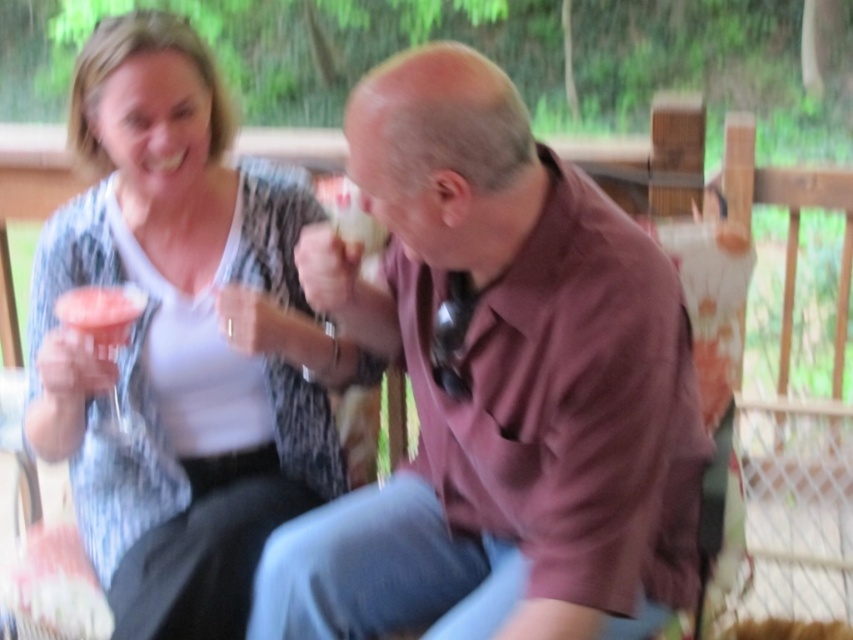
Which is below, brown matte shirt at center or matte white blouse at upper left?

Positioned lower is brown matte shirt at center.

Who is taller, brown matte shirt at center or matte white blouse at upper left?

matte white blouse at upper left is taller.

At what (x,y) coordinates should I click in order to perform the action: click on brown matte shirt at center. Please return your answer as a coordinate pair (x, y). This screenshot has width=853, height=640. Looking at the image, I should click on (497, 387).

I want to click on brown matte shirt at center, so click(x=497, y=387).